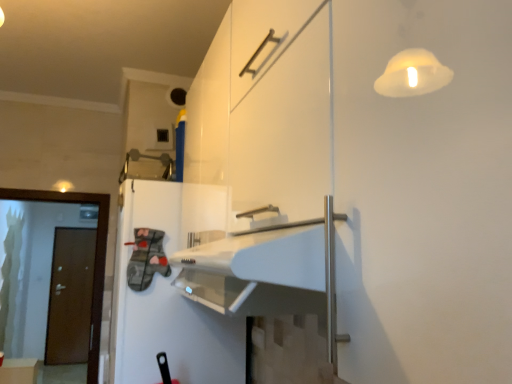
The height and width of the screenshot is (384, 512). In order to click on brown matte door at left in this screenshot , I will do `click(95, 255)`.

This screenshot has height=384, width=512. Describe the element at coordinates (19, 371) in the screenshot. I see `matte white cabinet at lower left` at that location.

You are a GUI agent. You are given a task and a screenshot of the screen. Output one action in this format:
    pyautogui.click(x=<x>, y=<y>)
    Task: Click on the brown matte door at left
    
    Given the screenshot: What is the action you would take?
    pyautogui.click(x=95, y=255)

How different are the orientations of brown matte door at left and white glossy refrigerator at center in degrees?

The angle between the facing direction of brown matte door at left and the facing direction of white glossy refrigerator at center is 89.6 degrees.

Would you say brown matte door at left is a long distance from white glossy refrigerator at center?

Yes.

From the image's perspective, which is above, brown matte door at left or white glossy refrigerator at center?

white glossy refrigerator at center, from the image's perspective.

Considering the points (94, 282) and (178, 338), which point is in front, point (94, 282) or point (178, 338)?

The point (178, 338) is closer.

Is white glossy refrigerator at center aimed at brown matte door at left?

No, white glossy refrigerator at center is not facing towards brown matte door at left.

Is the depth of white glossy refrigerator at center greater than that of brown matte door at left?

No, it is not.

Is white glossy refrigerator at center smaller than brown matte door at left?

Actually, white glossy refrigerator at center might be larger than brown matte door at left.

Does white glossy refrigerator at center have a lesser height compared to brown matte door at left?

Yes, white glossy refrigerator at center is shorter than brown matte door at left.

Is white glossy refrigerator at center oriented away from brown matte door at left?

That's not correct — white glossy refrigerator at center is not looking away from brown matte door at left.

Does white glossy refrigerator at center contain brown matte door at left?

No, white glossy refrigerator at center does not contain brown matte door at left.

Which is in front, point (111, 331) or point (87, 350)?

Positioned in front is point (111, 331).

From the picture: From the image's perspective, which one is positioned higher, white glossy refrigerator at center or brown matte door at left?

From the image's view, white glossy refrigerator at center is above.

Is brown matte door at left inside the boundaries of brown matte door at left, or outside?

brown matte door at left is outside brown matte door at left.

From a real-world perspective, is brown matte door at left positioned above or below brown matte door at left?

From a real-world perspective, brown matte door at left is physically above brown matte door at left.

Can you see brown matte door at left touching brown matte door at left?

No.

From their relative heights in the image, would you say brown matte door at left is taller or shorter than white glossy refrigerator at center?

Considering their sizes, brown matte door at left has more height than white glossy refrigerator at center.

Does point (74, 289) lie in front of point (121, 292)?

No, it is not.

Considering the positions of objects brown matte door at left and white glossy refrigerator at center in the image provided, who is more to the left, brown matte door at left or white glossy refrigerator at center?

Positioned to the left is brown matte door at left.

Consider the image. From a real-world perspective, is brown matte door at left beneath white glossy refrigerator at center?

Indeed, from a real-world perspective, brown matte door at left is positioned beneath white glossy refrigerator at center.

Between matte white cabinet at lower left and brown matte door at left, which one is positioned in front?

brown matte door at left is closer to the camera.

From a real-world perspective, is matte white cabinet at lower left over brown matte door at left?

Incorrect, from a real-world perspective, matte white cabinet at lower left is lower than brown matte door at left.

Locate an element on the screen. This screenshot has width=512, height=384. cabinetry below the brown matte door at left (from a real-world perspective) is located at coordinates (19, 371).

Is matte white cabinet at lower left positioned with its back to brown matte door at left?

That's not correct — matte white cabinet at lower left is not looking away from brown matte door at left.

What's the angular difference between brown matte door at left and matte white cabinet at lower left's facing directions?

The facing directions of brown matte door at left and matte white cabinet at lower left are 90.9 degrees apart.

Based on their positions, is brown matte door at left located to the left or right of matte white cabinet at lower left?

brown matte door at left is to the right of matte white cabinet at lower left.

From the image's perspective, is brown matte door at left on matte white cabinet at lower left?

Indeed, from the image's perspective, brown matte door at left is shown above matte white cabinet at lower left.

Does point (106, 222) lie in front of point (28, 381)?

Yes, point (106, 222) is in front of point (28, 381).

You are a GUI agent. You are given a task and a screenshot of the screen. Output one action in this format:
    pyautogui.click(x=<x>, y=<y>)
    Task: Click on the wide lying above the brown matte door at left (from the image's perspective)
    The image size is (512, 384).
    Given the screenshot: What is the action you would take?
    pyautogui.click(x=166, y=304)

Where is `screen door located on the left of white glossy refrigerator at center`? screen door located on the left of white glossy refrigerator at center is located at coordinates (95, 255).

Looking at the image, which one is located further to white glossy refrigerator at center, brown matte door at left or matte white cabinet at lower left?

The object further to white glossy refrigerator at center is brown matte door at left.

Which object lies further to the anchor point matte white cabinet at lower left, brown matte door at left or white glossy refrigerator at center?

Based on the image, white glossy refrigerator at center appears to be further to matte white cabinet at lower left.

Considering their positions, is brown matte door at left positioned closer to brown matte door at left than white glossy refrigerator at center?

The object closer to brown matte door at left is brown matte door at left.

Which object lies further to the anchor point brown matte door at left, matte white cabinet at lower left or white glossy refrigerator at center?

white glossy refrigerator at center is further to brown matte door at left.

From the image, which object appears to be farther from brown matte door at left, white glossy refrigerator at center or matte white cabinet at lower left?

Among the two, matte white cabinet at lower left is located further to brown matte door at left.

Considering their positions, is matte white cabinet at lower left positioned closer to brown matte door at left than white glossy refrigerator at center?

white glossy refrigerator at center.

When comparing their distances from brown matte door at left, does matte white cabinet at lower left or brown matte door at left seem closer?

matte white cabinet at lower left is closer to brown matte door at left.

Based on their spatial positions, is brown matte door at left or white glossy refrigerator at center closer to brown matte door at left?

Among the two, white glossy refrigerator at center is located nearer to brown matte door at left.

You are a GUI agent. You are given a task and a screenshot of the screen. Output one action in this format:
    pyautogui.click(x=<x>, y=<y>)
    Task: Click on the screen door positioned between white glossy refrigerator at center and matte white cabinet at lower left from near to far
    This screenshot has height=384, width=512.
    Given the screenshot: What is the action you would take?
    pyautogui.click(x=95, y=255)

The height and width of the screenshot is (384, 512). I want to click on cabinetry between brown matte door at left and brown matte door at left along the z-axis, so click(x=19, y=371).

Image resolution: width=512 pixels, height=384 pixels. What are the coordinates of `cabinetry between white glossy refrigerator at center and brown matte door at left along the z-axis` in the screenshot? It's located at (19, 371).

Identify the location of screen door located between white glossy refrigerator at center and brown matte door at left in the depth direction. The width and height of the screenshot is (512, 384). (95, 255).